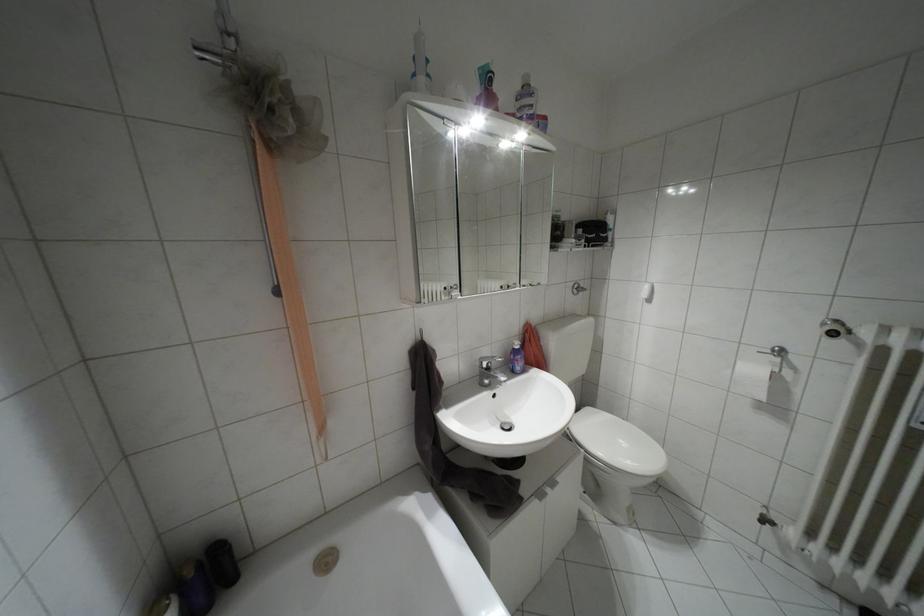
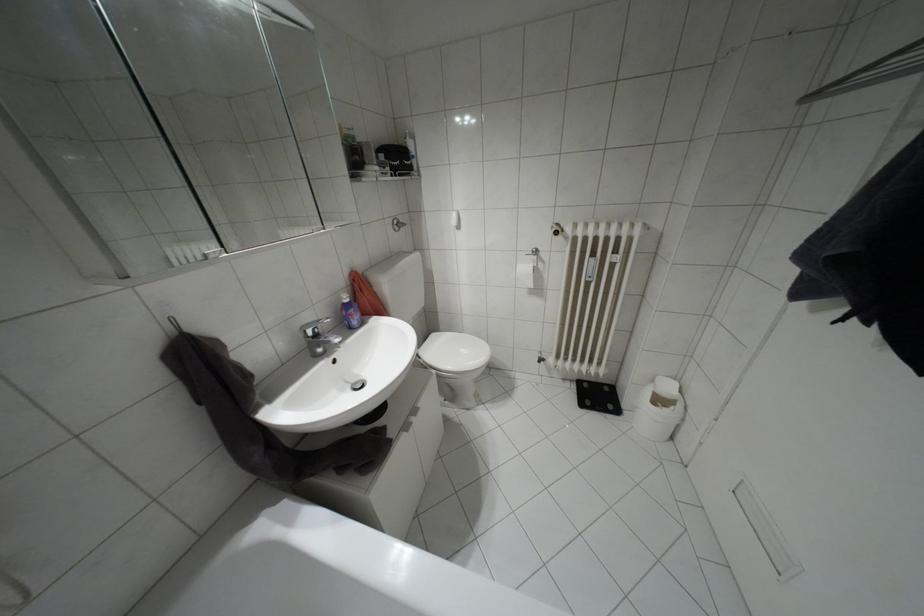
In the second image, find the point that corresponds to (x=574, y=292) in the first image.

(395, 229)